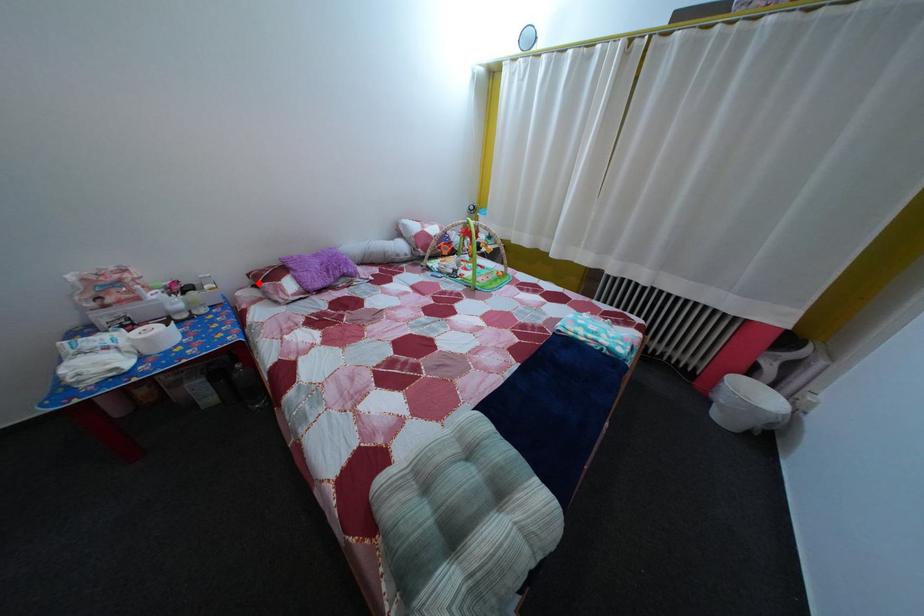
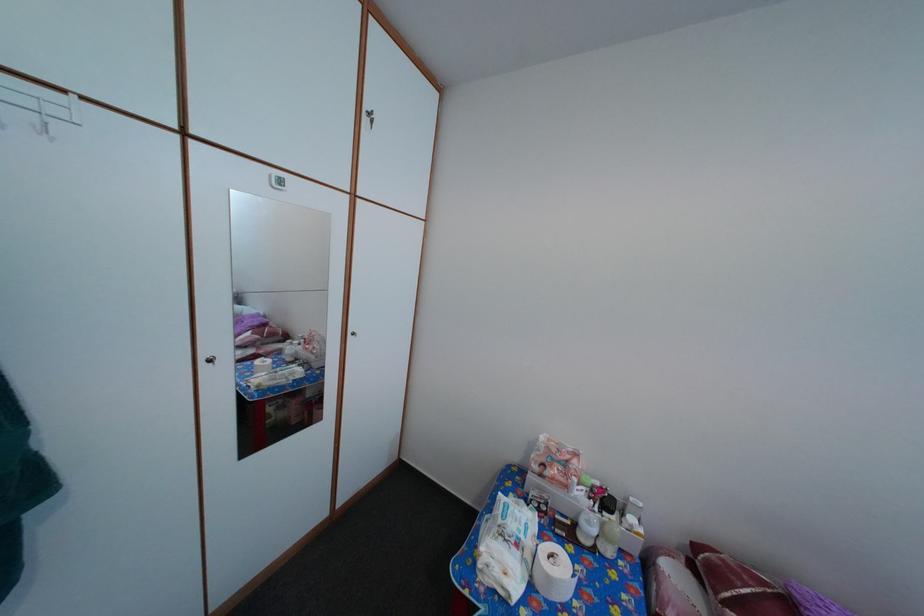
Locate, in the second image, the point that corresponds to the highlighted location in the first image.

(704, 554)